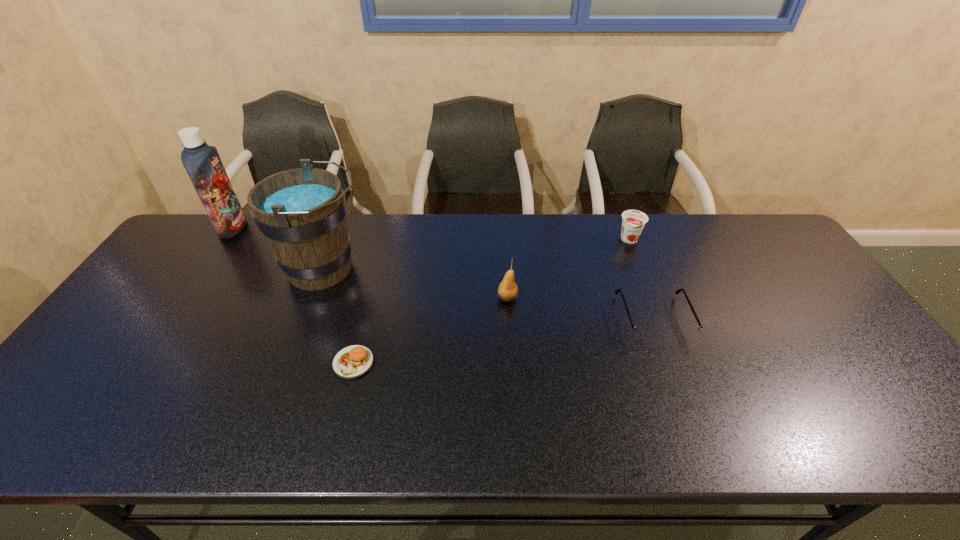
The width and height of the screenshot is (960, 540). I want to click on unoccupied area between the leftmost object and the third tallest object, so click(371, 263).

What are the coordinates of `free space between the third tallest object and the yogurt` in the screenshot? It's located at (568, 269).

Identify which object is located as the nearest to the wine bucket. Please provide its 2D coordinates. Your answer should be formatted as a tuple, i.e. [(x, y)], where the tuple contains the x and y coordinates of a point satisfying the conditions above.

[(353, 361)]

Locate an element on the screen. The height and width of the screenshot is (540, 960). object that stands as the closest to the shampoo is located at coordinates (301, 212).

Locate an element on the screen. This screenshot has width=960, height=540. vacant area in the image that satisfies the following two spatial constraints: 1. on the back side of the yogurt; 2. on the left side of the fourth object from left to right is located at coordinates (504, 240).

Where is `vacant space that satisfies the following two spatial constraints: 1. on the front label of the pear; 2. on the right side of the leftmost object`? Image resolution: width=960 pixels, height=540 pixels. vacant space that satisfies the following two spatial constraints: 1. on the front label of the pear; 2. on the right side of the leftmost object is located at coordinates (186, 298).

Where is `free space that satisfies the following two spatial constraints: 1. on the back side of the fourth tallest object; 2. on the front label of the shampoo`? free space that satisfies the following two spatial constraints: 1. on the back side of the fourth tallest object; 2. on the front label of the shampoo is located at coordinates (625, 228).

This screenshot has width=960, height=540. Find the location of `free space that satisfies the following two spatial constraints: 1. on the back side of the fourth shortest object; 2. with a handle on the side of the wine bucket`. free space that satisfies the following two spatial constraints: 1. on the back side of the fourth shortest object; 2. with a handle on the side of the wine bucket is located at coordinates [x=506, y=269].

This screenshot has height=540, width=960. Find the location of `blank space that satisfies the following two spatial constraints: 1. on the front label of the patty; 2. on the left side of the shampoo`. blank space that satisfies the following two spatial constraints: 1. on the front label of the patty; 2. on the left side of the shampoo is located at coordinates (142, 362).

Identify the location of vacant space that satisfies the following two spatial constraints: 1. on the front label of the shortest object; 2. on the right side of the leftmost object. The width and height of the screenshot is (960, 540). (142, 362).